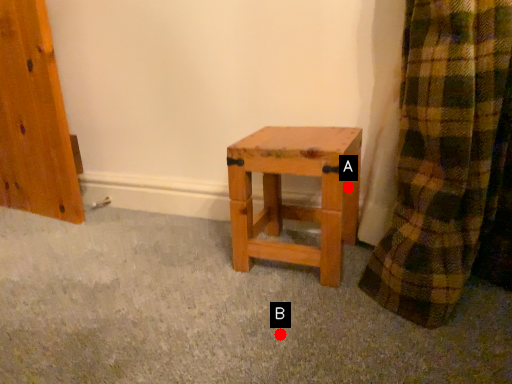
Question: Two points are circled on the image, labeled by A and B beside each circle. Which point appears closest to the camera in this image?

Choices:
 (A) A is closer
 (B) B is closer

Answer: (B)